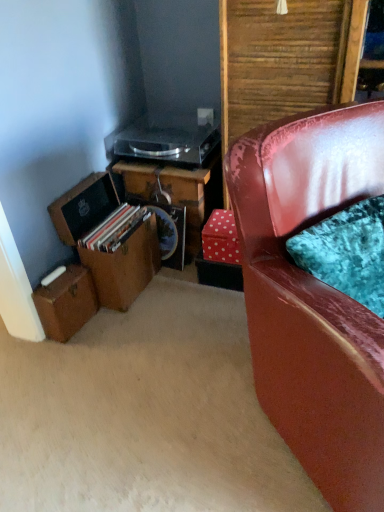
The height and width of the screenshot is (512, 384). What are the coordinates of `free space on the front side of brown leather suitcase at lower left, which appears as the 2th box when viewed from the top` in the screenshot? It's located at (63, 358).